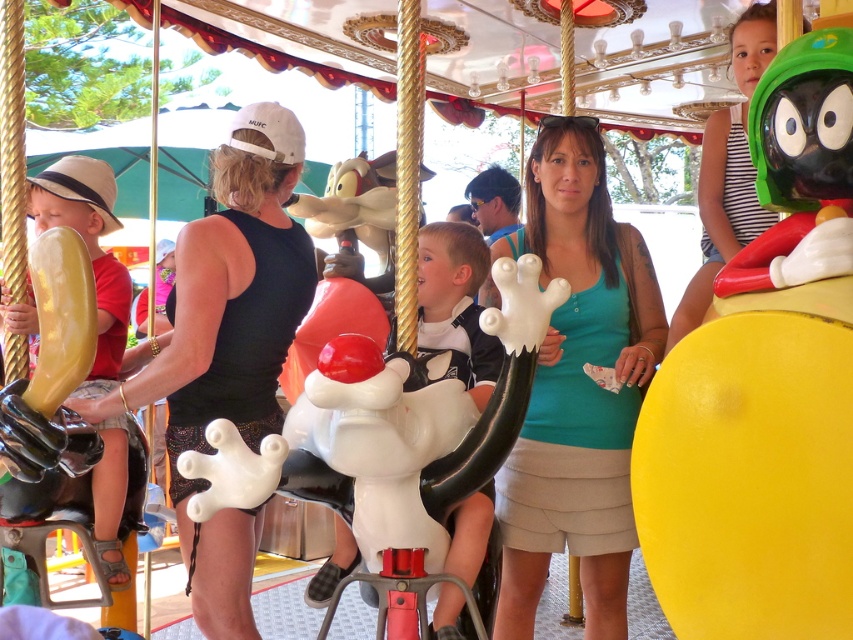
Is point (167, 440) farther from camera compared to point (834, 150)?

That is True.

Does point (218, 266) lie in front of point (843, 216)?

No, it is behind (843, 216).

The height and width of the screenshot is (640, 853). I want to click on black matte tank top at center, so click(x=227, y=346).

Is black matte tank top at center further to the viewer compared to yellow matte balloon at left?

Yes.

Does point (242, 164) come in front of point (103, 163)?

Yes.

Is point (222, 595) farther from viewer compared to point (112, 300)?

No, it is not.

Where is `black matte tank top at center`? black matte tank top at center is located at coordinates (227, 346).

Does green fabric shirt at center have a lesser height compared to black matte tank top at center?

No, green fabric shirt at center is not shorter than black matte tank top at center.

Between point (561, 227) and point (189, 413), which one is positioned behind?

The point (561, 227) is behind.

At what (x,y) coordinates should I click in order to perform the action: click on green fabric shirt at center. Please return your answer as a coordinate pair (x, y). This screenshot has width=853, height=640. Looking at the image, I should click on (577, 387).